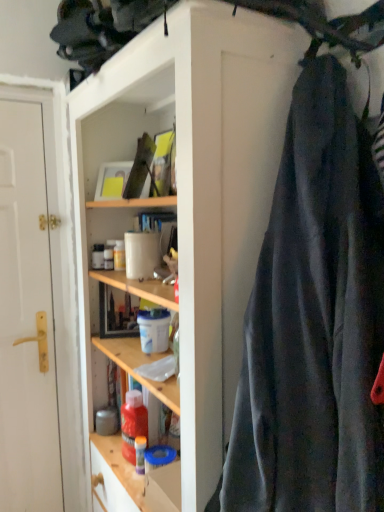
Question: From a real-world perspective, is wooden shelves at center below white matte door at left?

Choices:
 (A) no
 (B) yes

Answer: (B)

Question: Is wooden shelves at center to the left of white matte door at left from the viewer's perspective?

Choices:
 (A) yes
 (B) no

Answer: (B)

Question: Is wooden shelves at center aimed at white matte door at left?

Choices:
 (A) no
 (B) yes

Answer: (A)

Question: From the image's perspective, would you say wooden shelves at center is positioned over white matte door at left?

Choices:
 (A) yes
 (B) no

Answer: (B)

Question: Considering the relative sizes of wooden shelves at center and white matte door at left in the image provided, is wooden shelves at center bigger than white matte door at left?

Choices:
 (A) no
 (B) yes

Answer: (B)

Question: Considering the relative positions of wooden shelves at center and white matte door at left in the image provided, is wooden shelves at center behind white matte door at left?

Choices:
 (A) no
 (B) yes

Answer: (A)

Question: Can you confirm if white matte door at left is bigger than wooden shelves at center?

Choices:
 (A) no
 (B) yes

Answer: (A)

Question: Considering the relative positions of white matte door at left and wooden shelves at center in the image provided, is white matte door at left in front of wooden shelves at center?

Choices:
 (A) yes
 (B) no

Answer: (B)

Question: Does white matte door at left have a smaller size compared to wooden shelves at center?

Choices:
 (A) no
 (B) yes

Answer: (B)

Question: Is white matte door at left facing away from wooden shelves at center?

Choices:
 (A) no
 (B) yes

Answer: (A)

Question: Considering the relative sizes of white matte door at left and wooden shelves at center in the image provided, is white matte door at left taller than wooden shelves at center?

Choices:
 (A) no
 (B) yes

Answer: (B)

Question: Could you tell me if white matte door at left is turned towards wooden shelves at center?

Choices:
 (A) yes
 (B) no

Answer: (B)

Question: Is dark gray fabric at right shorter than white matte door at left?

Choices:
 (A) yes
 (B) no

Answer: (A)